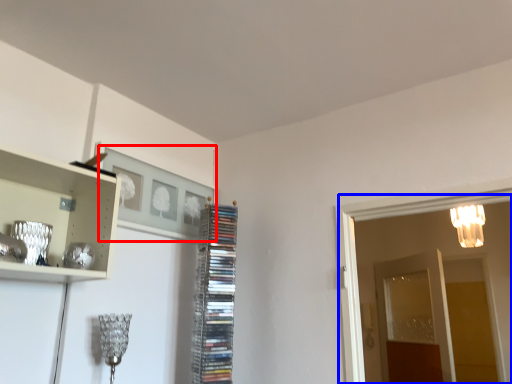
Question: Which object is closer to the camera taking this photo, picture frame (highlighted by a red box) or glass door (highlighted by a blue box)?

Choices:
 (A) picture frame
 (B) glass door

Answer: (A)